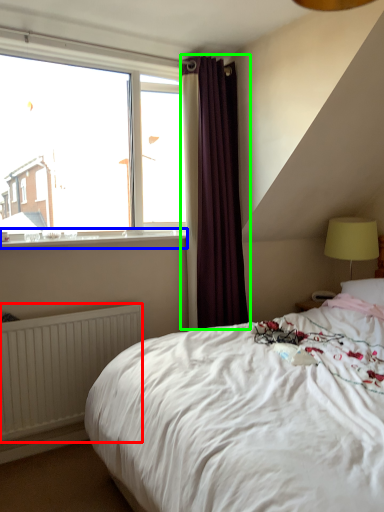
Question: Based on their relative distances, which object is nearer to radiator (highlighted by a red box)? Choose from window sill (highlighted by a blue box) and curtain (highlighted by a green box).

Choices:
 (A) window sill
 (B) curtain

Answer: (A)